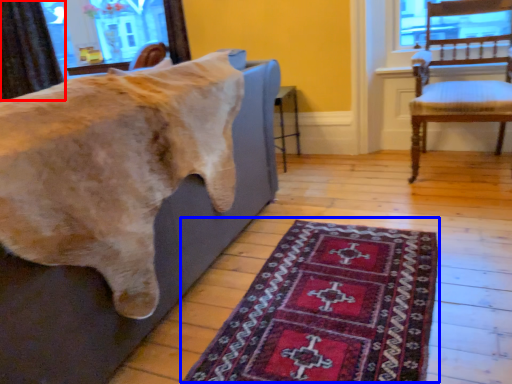
Question: Which object appears closest to the camera in this image, curtain (highlighted by a red box) or mat (highlighted by a blue box)?

Choices:
 (A) curtain
 (B) mat

Answer: (B)